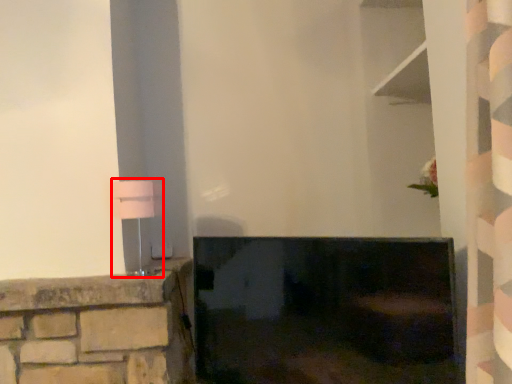
Question: From the image's perspective, where is table lamp (annotated by the red box) located relative to fireplace?

Choices:
 (A) above
 (B) below

Answer: (A)